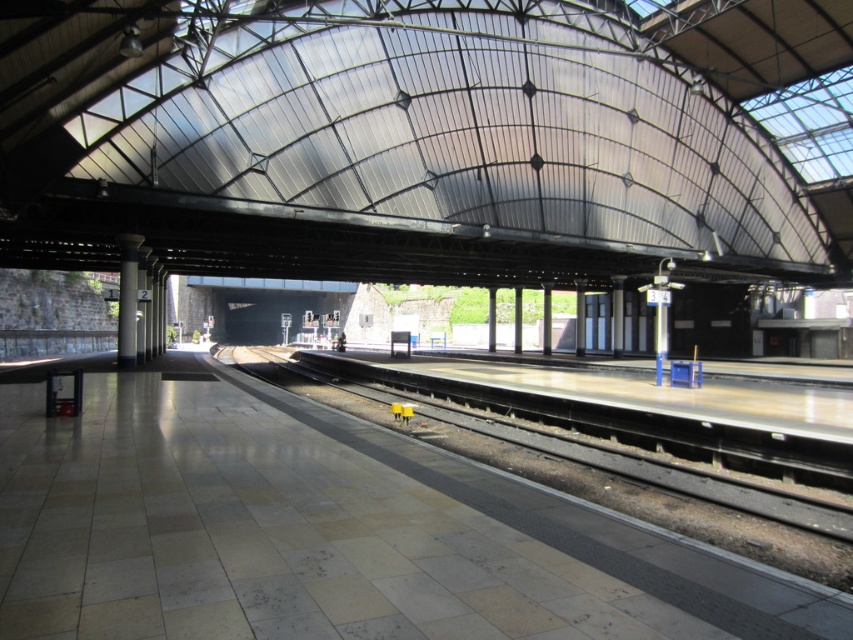
Is smooth concrete platform at center to the left of smooth concrete pillar at center from the viewer's perspective?

No, smooth concrete platform at center is not to the left of smooth concrete pillar at center.

Does point (294, 404) come farther from viewer compared to point (128, 244)?

No, (294, 404) is in front of (128, 244).

The height and width of the screenshot is (640, 853). Find the location of `smooth concrete platform at center`. smooth concrete platform at center is located at coordinates (329, 532).